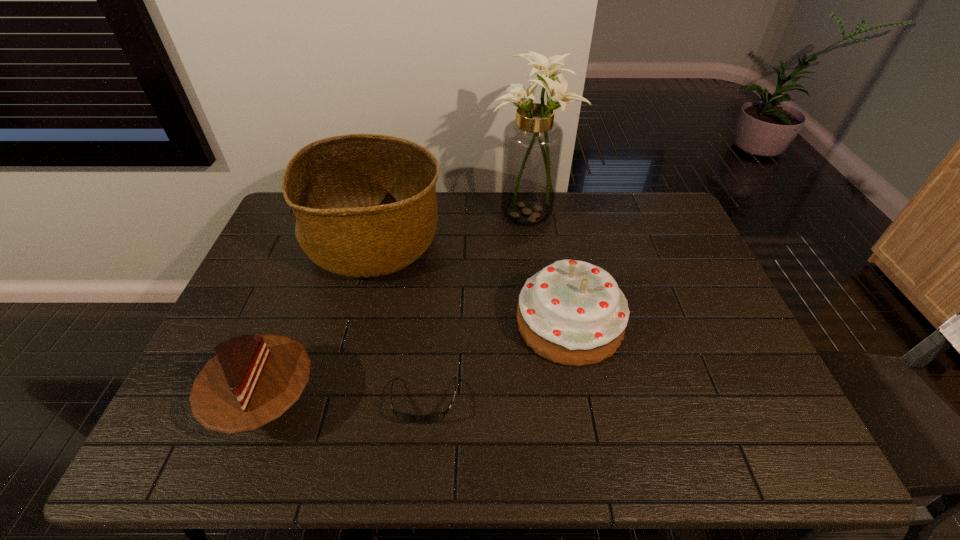
Identify the location of vacant space at the left edge of the desktop. pos(288,233).

At what (x,y) coordinates should I click in order to perform the action: click on vacant space at the right edge. Please return your answer as a coordinate pair (x, y). The image size is (960, 540). Looking at the image, I should click on (766, 392).

The width and height of the screenshot is (960, 540). What are the coordinates of `free space between the left cake and the shortest object` in the screenshot? It's located at (346, 401).

Locate an element on the screen. This screenshot has width=960, height=540. vacant area that lies between the shorter cake and the second tallest object is located at coordinates tap(321, 322).

Locate an element on the screen. vacant area that lies between the fourth tallest object and the fourth shortest object is located at coordinates (321, 322).

You are a GUI agent. You are given a task and a screenshot of the screen. Output one action in this format:
    pyautogui.click(x=<x>, y=<y>)
    Task: Click on the vacant space that's between the fourth shortest object and the second shortest object
    Image resolution: width=960 pixels, height=540 pixels.
    Given the screenshot: What is the action you would take?
    pyautogui.click(x=321, y=322)

Locate an element on the screen. This screenshot has height=540, width=960. vacant space that's between the shortest object and the right cake is located at coordinates (497, 362).

The height and width of the screenshot is (540, 960). In order to click on free space that is in between the shorter cake and the right cake in this screenshot , I will do `click(418, 363)`.

The height and width of the screenshot is (540, 960). I want to click on vacant region between the sunglasses and the right cake, so tap(497, 362).

You are a GUI agent. You are given a task and a screenshot of the screen. Output one action in this format:
    pyautogui.click(x=<x>, y=<y>)
    Task: Click on the empty space that is in between the shorter cake and the shortest object
    The image size is (960, 540).
    Given the screenshot: What is the action you would take?
    pyautogui.click(x=346, y=401)